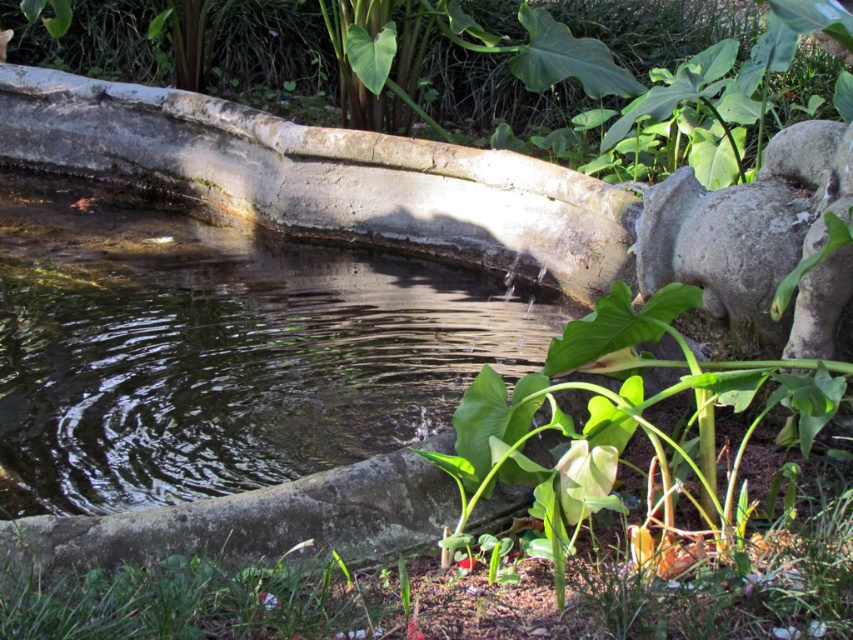
Can you confirm if green leafy plant at upper center is bigger than gray stone pig at upper right?

Actually, green leafy plant at upper center might be smaller than gray stone pig at upper right.

Can you confirm if green leafy plant at upper center is wider than gray stone pig at upper right?

Incorrect, green leafy plant at upper center's width does not surpass gray stone pig at upper right's.

Is point (178, 65) positioned in front of point (831, 300)?

No.

At what (x,y) coordinates should I click in order to perform the action: click on green leafy plant at upper center. Please return your answer as a coordinate pair (x, y). The width and height of the screenshot is (853, 640). Looking at the image, I should click on (457, 60).